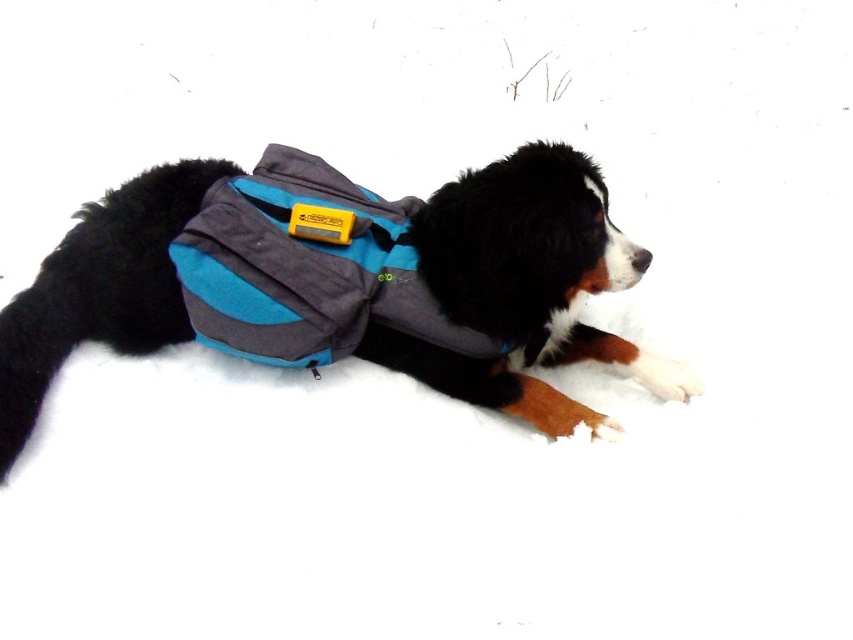
Question: Which of the following is the farthest from the observer?

Choices:
 (A) (535, 397)
 (B) (228, 289)

Answer: (A)

Question: Which point appears closest to the camera in this image?

Choices:
 (A) (274, 356)
 (B) (572, 296)

Answer: (B)

Question: Does soft gray fabric dog vest at center appear on the left side of teal fabric life jacket at center?

Choices:
 (A) no
 (B) yes

Answer: (A)

Question: Is soft gray fabric dog vest at center positioned behind teal fabric life jacket at center?

Choices:
 (A) no
 (B) yes

Answer: (A)

Question: Is soft gray fabric dog vest at center closer to camera compared to teal fabric life jacket at center?

Choices:
 (A) no
 (B) yes

Answer: (B)